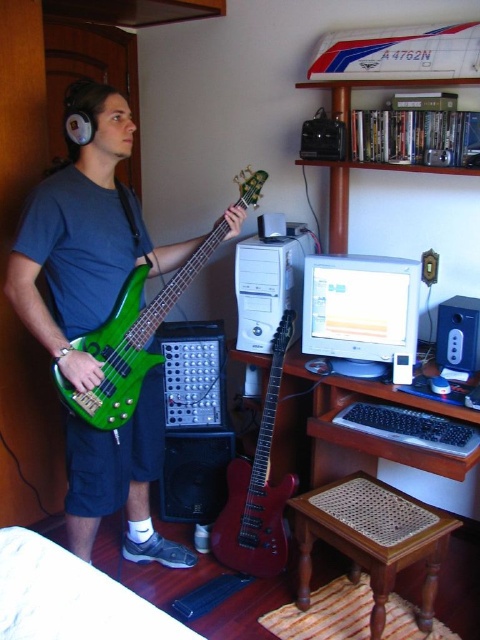
Question: Observing the image, what is the correct spatial positioning of brown woven stool at lower center in reference to white plastic desktop computer at center?

Choices:
 (A) left
 (B) right

Answer: (B)

Question: Which object appears farthest from the camera in this image?

Choices:
 (A) matte white monitor at center
 (B) glossy red electric guitar at center
 (C) brown woven stool at lower center

Answer: (B)

Question: Which point is farther from the camera taking this photo?

Choices:
 (A) (266, 417)
 (B) (423, 548)
 (C) (245, 317)

Answer: (C)

Question: Estimate the real-world distances between objects in this image. Which object is farther from the brown woven stool at lower center?

Choices:
 (A) green matte/glossy bass guitar at left
 (B) green glossy bass guitar at center
 (C) glossy red electric guitar at center

Answer: (B)

Question: From the image, what is the correct spatial relationship of green matte/glossy bass guitar at left in relation to matte white monitor at center?

Choices:
 (A) right
 (B) left

Answer: (B)

Question: Is brown woven stool at lower center further to camera compared to white plastic desktop computer at center?

Choices:
 (A) no
 (B) yes

Answer: (A)